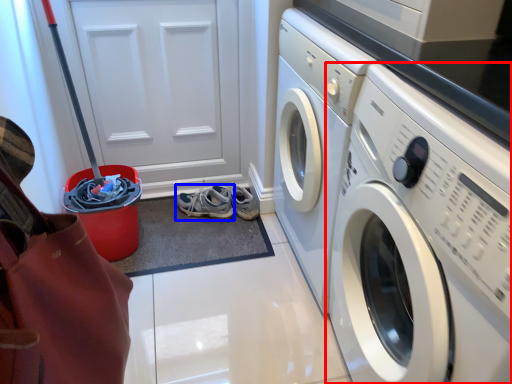
Question: Which of the following is the closest to the observer, washing machine (highlighted by a red box) or running shoe (highlighted by a blue box)?

Choices:
 (A) washing machine
 (B) running shoe

Answer: (A)